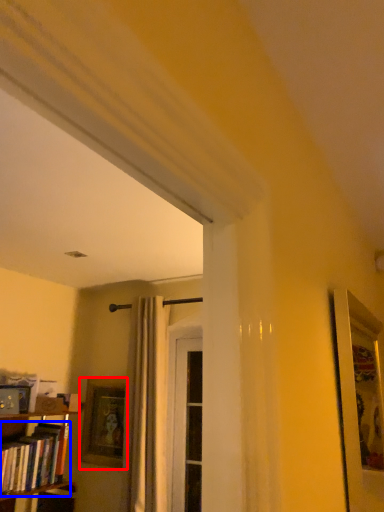
Question: Which object appears closest to the camera in this image, picture frame (highlighted by a red box) or book (highlighted by a blue box)?

Choices:
 (A) picture frame
 (B) book

Answer: (B)